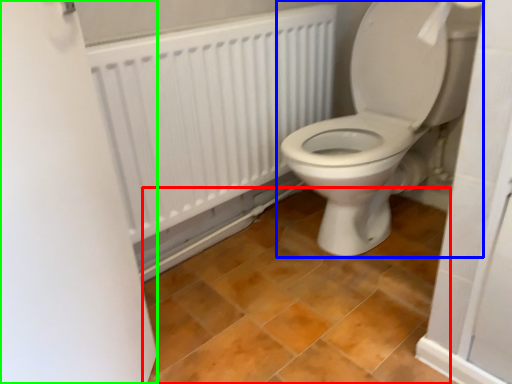
Question: Considering the real-world distances, which object is closest to ceramic tile (highlighted by a red box)? toilet (highlighted by a blue box) or screen door (highlighted by a green box).

Choices:
 (A) toilet
 (B) screen door

Answer: (A)